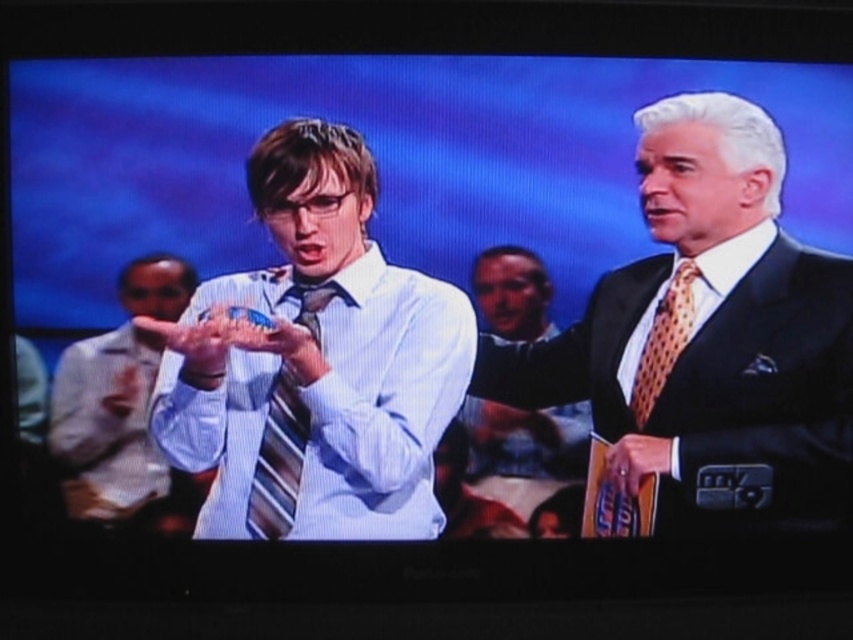
In the scene from the game show, there is a striped fabric tie at center. What are its exact coordinates?

The striped fabric tie at center is located at coordinates (277, 460).

You are a contestant on a game show and need to determine the spatial relationship between the striped tie at center and the shiny black suit at right. Based on the scene, which object is closer to the camera?

The striped tie at center is behind the shiny black suit at right, so the shiny black suit at right is closer to the camera.